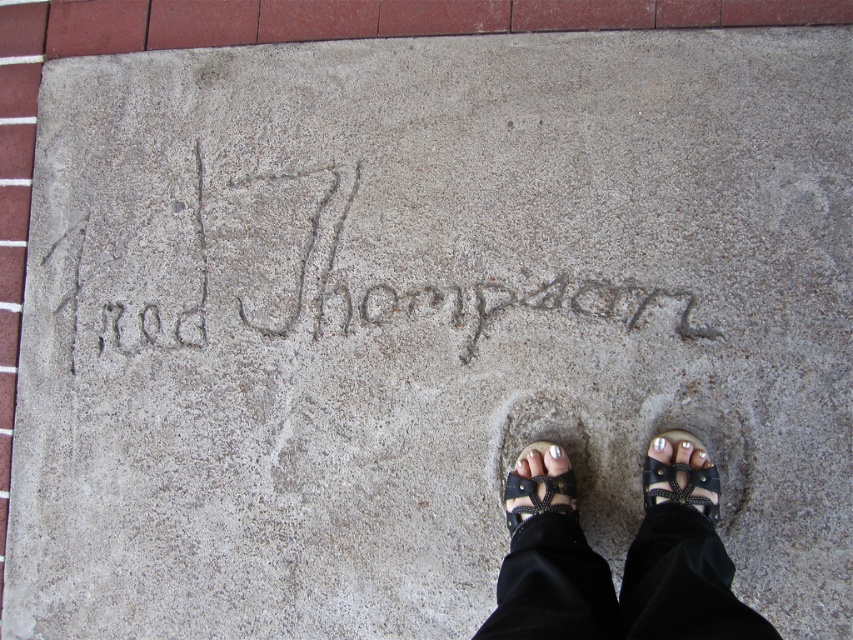
Question: Is black leather sandals at center behind black leather sandal at center?

Choices:
 (A) no
 (B) yes

Answer: (A)

Question: Which object is positioned farthest from the black leather sandal at center?

Choices:
 (A) black leather sandals at center
 (B) gray concrete writing at center

Answer: (B)

Question: Estimate the real-world distances between objects in this image. Which object is farther from the gray concrete writing at center?

Choices:
 (A) black leather sandal at center
 (B) black leather sandal at lower right

Answer: (B)

Question: Is gray concrete writing at center above black leather sandal at lower right?

Choices:
 (A) no
 (B) yes

Answer: (B)

Question: Does black leather sandals at center appear over black leather sandal at center?

Choices:
 (A) yes
 (B) no

Answer: (B)

Question: Which is farther from the gray concrete writing at center?

Choices:
 (A) black leather sandal at lower right
 (B) black leather sandal at center

Answer: (A)